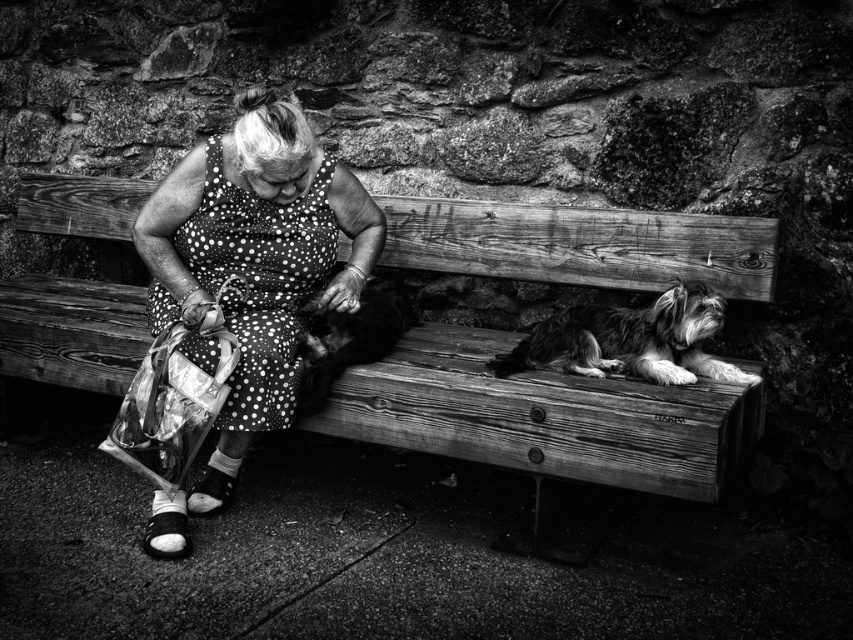
In the black and white photo, there is an elderly woman wearing a polka dot fabric dress at center and a soft fur dog at center. Which of these two items is bigger in size?

The polka dot fabric dress at center has a larger size compared to the soft fur dog at center, so the polka dot fabric dress at center is bigger.

You are an artist analyzing this black and white photo. You notice the polka dot fabric dress at center and the soft fur dog at center. Which object is closer to the viewer?

The polka dot fabric dress at center is in front of the soft fur dog at center, so it is closer to the viewer.

Based on the scene description, what object is located at the coordinates point (544, 417)?

The point (544, 417) corresponds to the wooden bench at center.